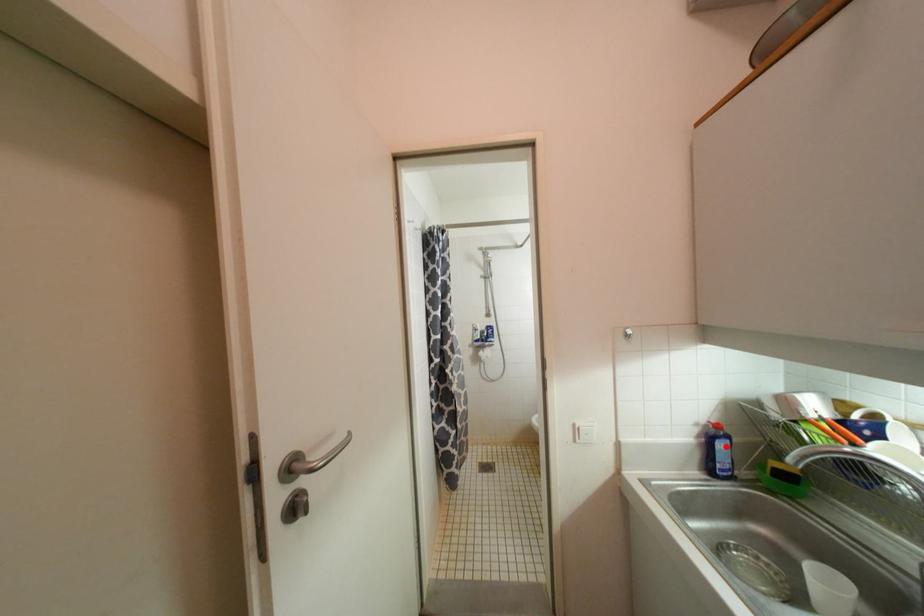
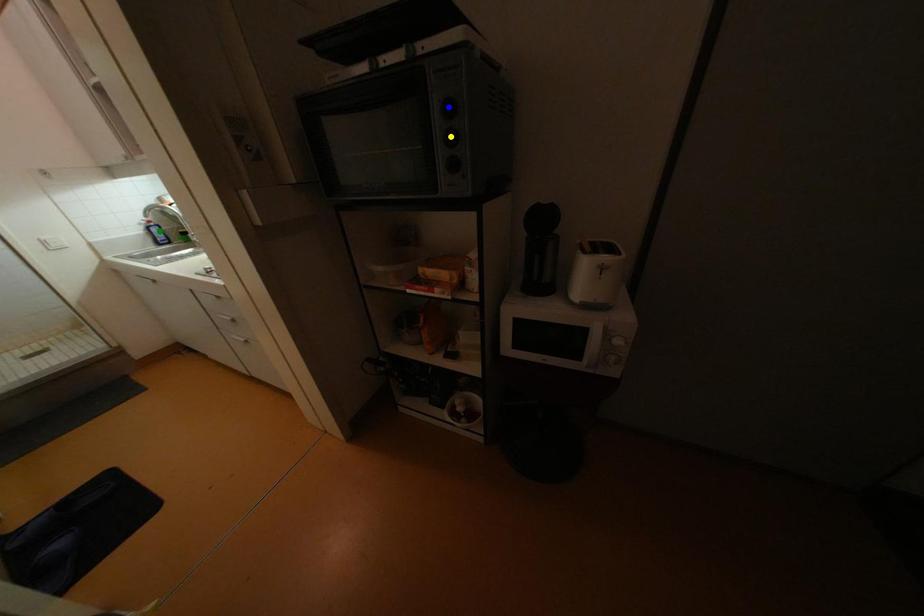
Question: I am providing you with two images of the same scene from different viewpoints. A red point is marked on the first image. You are given multiple points on the second image. In image 2, which mark is for the same physical point as the one in image 1?

Choices:
 (A) green point
 (B) blue point
 (C) yellow point

Answer: (A)